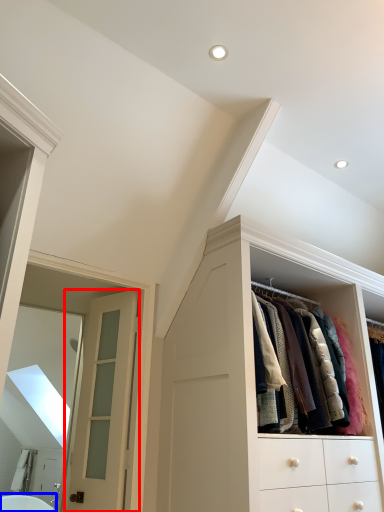
Question: Which point is closer to the camera, door (highlighted by a red box) or bath (highlighted by a blue box)?

Choices:
 (A) door
 (B) bath

Answer: (A)